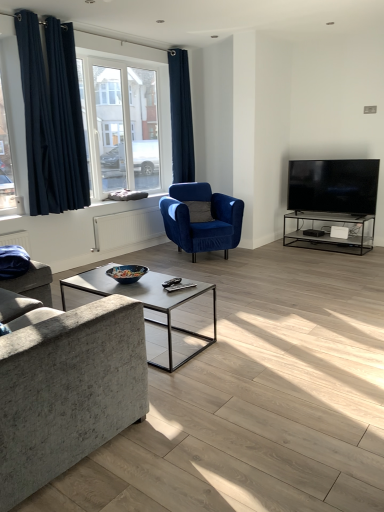
Where is `free point above clear glass window at upper left (from a real-world perspective)`? Image resolution: width=384 pixels, height=512 pixels. free point above clear glass window at upper left (from a real-world perspective) is located at coordinates (124, 56).